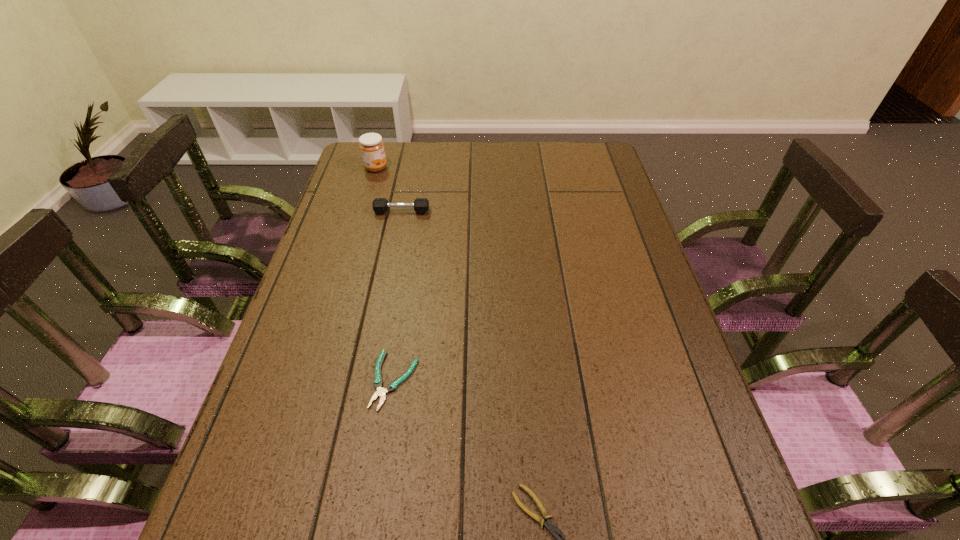
Where is `free location that satisfies the following two spatial constraints: 1. on the back side of the third farthest object; 2. on the front label of the tallest object`? Image resolution: width=960 pixels, height=540 pixels. free location that satisfies the following two spatial constraints: 1. on the back side of the third farthest object; 2. on the front label of the tallest object is located at coordinates (427, 168).

The height and width of the screenshot is (540, 960). In order to click on vacant position in the image that satisfies the following two spatial constraints: 1. on the front label of the jam; 2. on the back side of the farther pliers in this screenshot , I will do `click(312, 380)`.

The image size is (960, 540). Find the location of `vacant region that satisfies the following two spatial constraints: 1. on the front label of the tallest object; 2. on the left side of the farther pliers`. vacant region that satisfies the following two spatial constraints: 1. on the front label of the tallest object; 2. on the left side of the farther pliers is located at coordinates (312, 380).

You are a GUI agent. You are given a task and a screenshot of the screen. Output one action in this format:
    pyautogui.click(x=<x>, y=<y>)
    Task: Click on the vacant space that satisfies the following two spatial constraints: 1. on the front label of the third farthest object; 2. on the right side of the farthest object
    
    Given the screenshot: What is the action you would take?
    pyautogui.click(x=312, y=380)

I want to click on free location that satisfies the following two spatial constraints: 1. on the front label of the second tallest object; 2. on the right side of the tallest object, so [363, 212].

You are a GUI agent. You are given a task and a screenshot of the screen. Output one action in this format:
    pyautogui.click(x=<x>, y=<y>)
    Task: Click on the free spot that satisfies the following two spatial constraints: 1. on the front label of the second farthest object; 2. on the left side of the jam
    
    Given the screenshot: What is the action you would take?
    pyautogui.click(x=363, y=212)

Locate an element on the screen. The width and height of the screenshot is (960, 540). free location that satisfies the following two spatial constraints: 1. on the front label of the farthest object; 2. on the right side of the farther pliers is located at coordinates (312, 380).